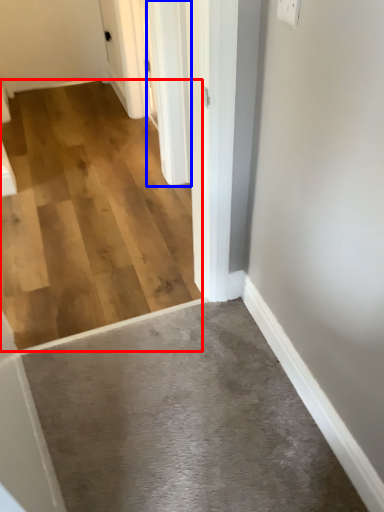
Question: Which object is closer to the camera taking this photo, concrete (highlighted by a red box) or door (highlighted by a blue box)?

Choices:
 (A) concrete
 (B) door

Answer: (A)